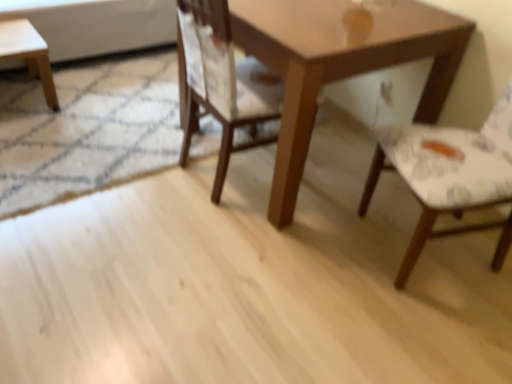
Question: Is light brown wooden stool at left wider than white fabric chair at right, marked as the 2th chair in a left-to-right arrangement?

Choices:
 (A) yes
 (B) no

Answer: (B)

Question: Is light brown wooden stool at left closer to the viewer compared to white fabric chair at right, marked as the 2th chair in a left-to-right arrangement?

Choices:
 (A) yes
 (B) no

Answer: (B)

Question: Considering the relative positions of light brown wooden stool at left and white fabric chair at right, which appears as the first chair when viewed from the right, in the image provided, is light brown wooden stool at left to the right of white fabric chair at right, which appears as the first chair when viewed from the right, from the viewer's perspective?

Choices:
 (A) no
 (B) yes

Answer: (A)

Question: From a real-world perspective, is light brown wooden stool at left below white fabric chair at right, which appears as the first chair when viewed from the right?

Choices:
 (A) yes
 (B) no

Answer: (A)

Question: Does light brown wooden stool at left have a greater height compared to white fabric chair at right, which appears as the first chair when viewed from the right?

Choices:
 (A) yes
 (B) no

Answer: (B)

Question: From a real-world perspective, is wooden chair at center, the 1th chair in the left-to-right sequence, positioned above or below light brown wooden stool at left?

Choices:
 (A) above
 (B) below

Answer: (A)

Question: Relative to light brown wooden stool at left, is wooden chair at center, the 1th chair in the left-to-right sequence, in front or behind?

Choices:
 (A) behind
 (B) front

Answer: (B)

Question: Choose the correct answer: Is wooden chair at center, the 1th chair in the left-to-right sequence, inside light brown wooden stool at left or outside it?

Choices:
 (A) inside
 (B) outside

Answer: (B)

Question: Considering the positions of wooden chair at center, acting as the second chair starting from the right, and light brown wooden stool at left in the image, is wooden chair at center, acting as the second chair starting from the right, bigger or smaller than light brown wooden stool at left?

Choices:
 (A) small
 (B) big

Answer: (B)

Question: Is point (199, 31) positioned closer to the camera than point (457, 178)?

Choices:
 (A) closer
 (B) farther

Answer: (B)

Question: Is wooden chair at center, the 1th chair in the left-to-right sequence, wider or thinner than white fabric chair at right, which appears as the first chair when viewed from the right?

Choices:
 (A) thin
 (B) wide

Answer: (A)

Question: From a real-world perspective, relative to white fabric chair at right, which appears as the first chair when viewed from the right, is wooden chair at center, the 1th chair in the left-to-right sequence, vertically above or below?

Choices:
 (A) above
 (B) below

Answer: (B)

Question: In the image, is wooden chair at center, acting as the second chair starting from the right, on the left side or the right side of white fabric chair at right, which appears as the first chair when viewed from the right?

Choices:
 (A) left
 (B) right

Answer: (A)

Question: In terms of width, does light brown wooden stool at left look wider or thinner when compared to wooden table at center?

Choices:
 (A) wide
 (B) thin

Answer: (B)

Question: From the image's perspective, relative to wooden table at center, is light brown wooden stool at left above or below?

Choices:
 (A) above
 (B) below

Answer: (A)